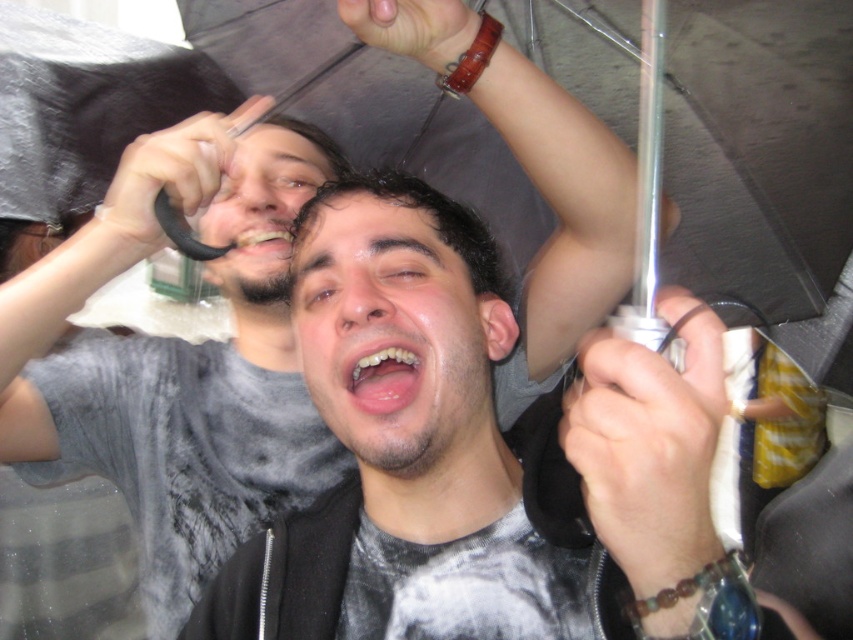
Question: Which point is closer to the camera?

Choices:
 (A) (788, 317)
 (B) (202, 170)

Answer: (B)

Question: Is transparent plastic umbrella at center bigger than matte gray shirt at left?

Choices:
 (A) yes
 (B) no

Answer: (A)

Question: Is transparent plastic umbrella at center positioned behind matte gray shirt at left?

Choices:
 (A) no
 (B) yes

Answer: (B)

Question: Is transparent plastic umbrella at center wider than matte gray shirt at left?

Choices:
 (A) no
 (B) yes

Answer: (B)